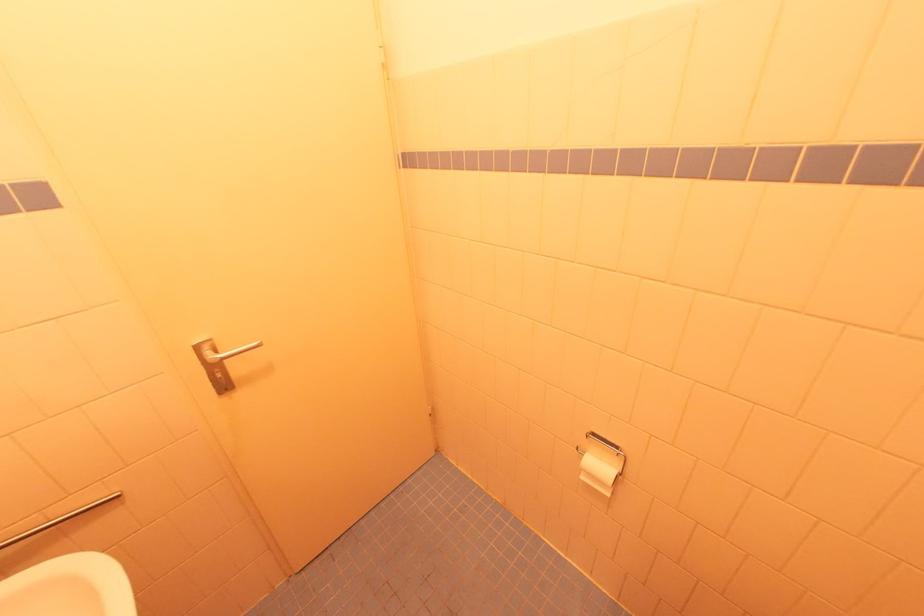
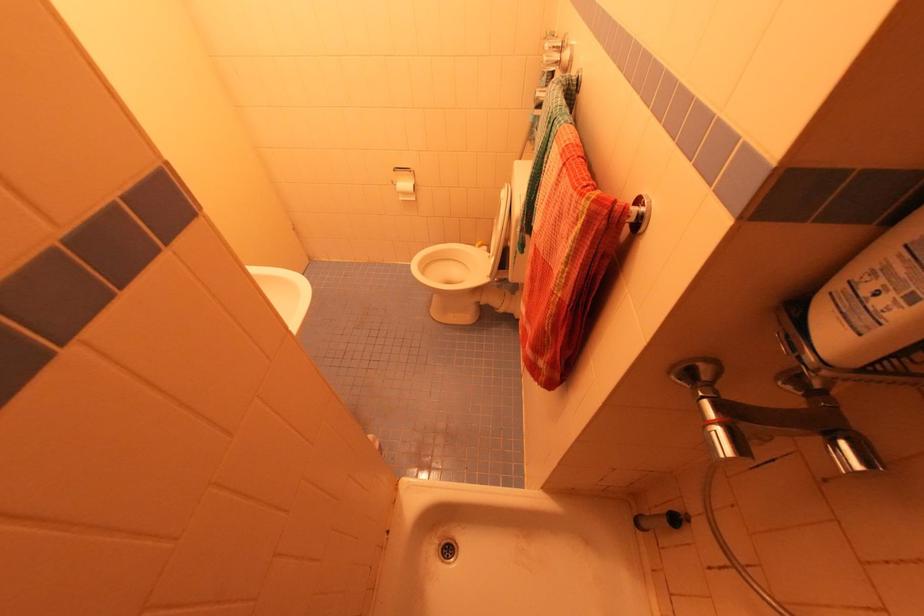
Question: I am providing you with two images of the same scene from different viewpoints. Which of the following objects are not visible in image2?

Choices:
 (A) toilet paper roll
 (B) chrome faucet handle
 (C) chrome towel hook
 (D) none of these

Answer: (D)